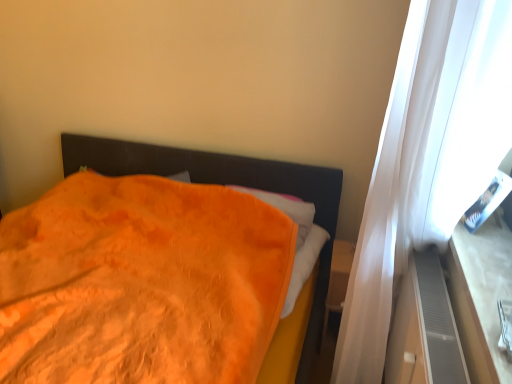
Image resolution: width=512 pixels, height=384 pixels. What do you see at coordinates (424, 328) in the screenshot?
I see `gray textured dresser at right` at bounding box center [424, 328].

The width and height of the screenshot is (512, 384). What do you see at coordinates (223, 184) in the screenshot?
I see `orange soft blanket at left` at bounding box center [223, 184].

Where is `gray textured dresser at right`? gray textured dresser at right is located at coordinates (424, 328).

Does orange soft blanket at left turn towards wooden at right?

No, orange soft blanket at left does not turn towards wooden at right.

Is orange soft blanket at left closer to camera compared to wooden at right?

Yes, orange soft blanket at left is closer to the camera.

Looking at this image, can you tell me how much orange soft blanket at left and wooden at right differ in facing direction?

orange soft blanket at left and wooden at right are facing 91.3 degrees away from each other.

Considering the sizes of objects orange soft blanket at left and wooden at right in the image provided, who is wider, orange soft blanket at left or wooden at right?

orange soft blanket at left is wider.

Is gray textured dresser at right facing away from orange soft blanket at left?

gray textured dresser at right is not turned away from orange soft blanket at left.

Can you confirm if gray textured dresser at right is wider than orange soft blanket at left?

Incorrect, the width of gray textured dresser at right does not surpass that of orange soft blanket at left.

Relative to orange soft blanket at left, is gray textured dresser at right in front or behind?

In the image, gray textured dresser at right appears behind orange soft blanket at left.

Considering the relative sizes of gray textured dresser at right and orange soft blanket at left in the image provided, is gray textured dresser at right bigger than orange soft blanket at left?

Incorrect, gray textured dresser at right is not larger than orange soft blanket at left.

Which object is thinner, gray textured dresser at right or wooden at right?

Thinner between the two is gray textured dresser at right.

Considering the sizes of objects gray textured dresser at right and wooden at right in the image provided, who is taller, gray textured dresser at right or wooden at right?

With more height is gray textured dresser at right.

You are a GUI agent. You are given a task and a screenshot of the screen. Output one action in this format:
    pyautogui.click(x=<x>, y=<y>)
    Task: Click on the dresser directly beneath the wooden at right (from a real-world perspective)
    
    Given the screenshot: What is the action you would take?
    pyautogui.click(x=424, y=328)

From the picture: Is wooden at right not near orange soft blanket at left?

wooden at right is actually quite close to orange soft blanket at left.

Is point (500, 254) farther from camera compared to point (298, 377)?

No, (500, 254) is closer to viewer.

How far apart are wooden at right and orange soft blanket at left?

93.57 centimeters.

How many degrees apart are the facing directions of wooden at right and orange soft blanket at left?

The angular difference between wooden at right and orange soft blanket at left is 91.3 degrees.

Is wooden at right next to gray textured dresser at right and touching it?

wooden at right and gray textured dresser at right are clearly separated.

I want to click on window sill that is in front of the gray textured dresser at right, so click(480, 296).

Considering the relative positions of wooden at right and gray textured dresser at right in the image provided, is wooden at right in front of gray textured dresser at right?

Yes, wooden at right is closer to the viewer.

Is wooden at right completely or partially outside of gray textured dresser at right?

Yes, wooden at right is outside of gray textured dresser at right.

Is orange soft blanket at left bigger or smaller than gray textured dresser at right?

Considering their sizes, orange soft blanket at left takes up more space than gray textured dresser at right.

Can gray textured dresser at right be found inside orange soft blanket at left?

No.

Consider the image. From a real-world perspective, is orange soft blanket at left above or below gray textured dresser at right?

In terms of real-world spatial position, orange soft blanket at left is below gray textured dresser at right.

Who is taller, orange soft blanket at left or gray textured dresser at right?

orange soft blanket at left is taller.

Find the location of a particular element. bed on the left of the wooden at right is located at coordinates (223, 184).

Find the location of `bed in front of the gray textured dresser at right`. bed in front of the gray textured dresser at right is located at coordinates (223, 184).

Which object lies nearer to the anchor point orange soft blanket at left, gray textured dresser at right or wooden at right?

Among the two, gray textured dresser at right is located nearer to orange soft blanket at left.

Looking at the image, which one is located further to orange soft blanket at left, wooden at right or gray textured dresser at right?

wooden at right is further to orange soft blanket at left.

Looking at the image, which one is located further to wooden at right, gray textured dresser at right or orange soft blanket at left?

Among the two, orange soft blanket at left is located further to wooden at right.

From the image, which object appears to be farther from gray textured dresser at right, orange soft blanket at left or wooden at right?

orange soft blanket at left lies further to gray textured dresser at right than the other object.

Which object lies nearer to the anchor point gray textured dresser at right, wooden at right or orange soft blanket at left?

wooden at right is closer to gray textured dresser at right.

From the image, which object appears to be farther from wooden at right, orange soft blanket at left or gray textured dresser at right?

orange soft blanket at left lies further to wooden at right than the other object.

At what (x,y) coordinates should I click in order to perform the action: click on dresser situated between orange soft blanket at left and wooden at right from left to right. Please return your answer as a coordinate pair (x, y). This screenshot has height=384, width=512. Looking at the image, I should click on (424, 328).